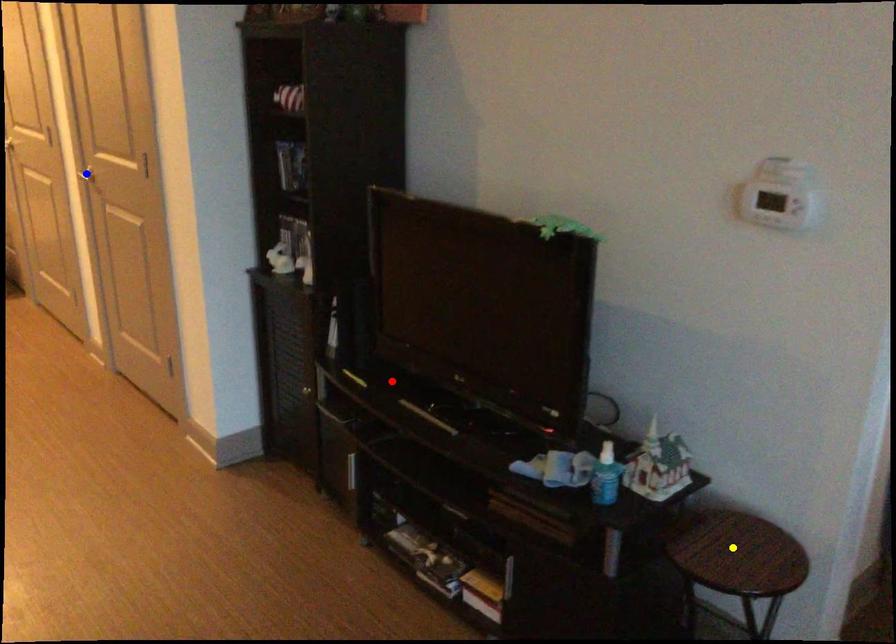
Order these from nearest to farthest:
yellow point
red point
blue point

yellow point → red point → blue point